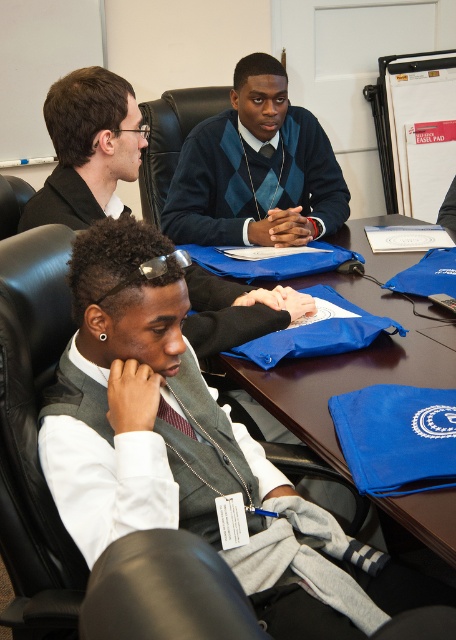
Question: Which object is closer to the camera taking this photo?

Choices:
 (A) blue fabric bag at center
 (B) dark blue argyle sweater at center
 (C) striped fabric tie at center

Answer: (A)

Question: Is dark blue argyle sweater at center below blue fabric bag at center?

Choices:
 (A) yes
 (B) no

Answer: (B)

Question: Where is gray vest at center located in relation to striped fabric tie at center in the image?

Choices:
 (A) above
 (B) below

Answer: (A)

Question: Which is nearer to the dark blue argyle sweater at center?

Choices:
 (A) blue fabric bag at center
 (B) gray vest at center
 (C) striped fabric tie at center

Answer: (A)

Question: Considering the real-world distances, which object is closest to the striped fabric tie at center?

Choices:
 (A) dark blue argyle sweater at center
 (B) blue fabric bag at center

Answer: (B)

Question: Where is dark blue argyle sweater at center located in relation to gray vest at center in the image?

Choices:
 (A) above
 (B) below

Answer: (A)